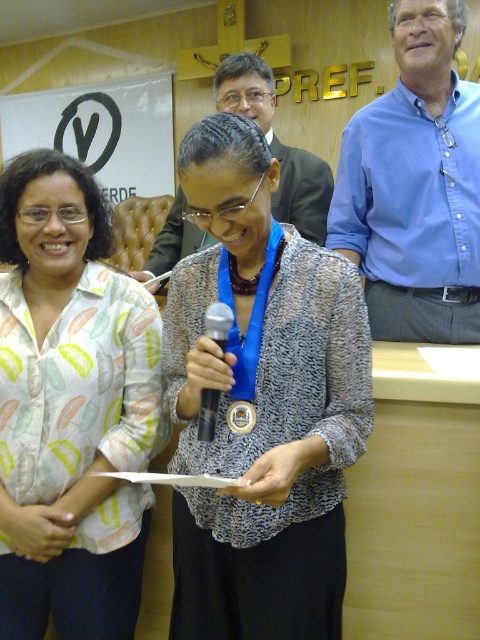
You are a photographer positioned at the front of the room. You want to capture a closeup shot of the blue fabric medal at center without moving the subject. Is the medal within your camera lens range if your camera can focus as close as 20 inches?

The blue fabric medal at center is 31.84 inches away from viewer. Since the camera can focus as close as 20 inches, the medal is within the camera lens range and can be captured in a closeup shot.

From the picture: You are a photographer positioned in front of the group. You need to focus your camera on the white printed blouse at left and the matte black suit at center. Which one should you adjust your focus to first to ensure it is sharp?

You should focus on the white printed blouse at left first because it is closer to the viewer than the matte black suit at center, so adjusting focus starting from the closer object ensures proper sharpness.

You are a photographer at a corporate event and need to adjust the camera angle to ensure both the blue cotton shirt at upper right and the matte black suit at center are clearly visible. Considering their heights, which adjustment should you make?

The blue cotton shirt at upper right is much taller than the matte black suit at center, so you should angle the camera slightly downward to capture the taller individual without cropping the shorter one.